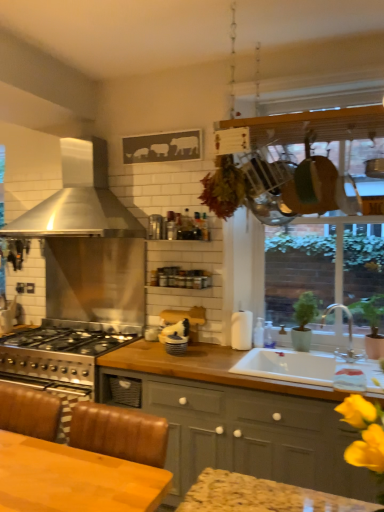
The width and height of the screenshot is (384, 512). I want to click on vacant space that is to the left of white paper towel dispenser at center, the second appliance in the bottom-to-top sequence, so click(220, 345).